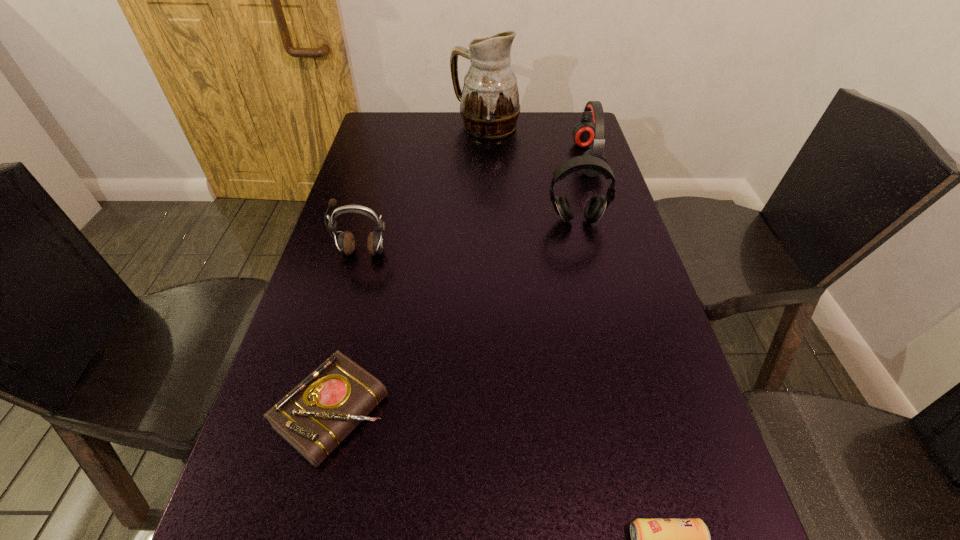
The image size is (960, 540). In order to click on blank space located 0.210m from the spout of the fourth object from right to left in this screenshot , I will do `click(392, 126)`.

Where is `free space located 0.220m on the ear cups of the second farthest earphone`? This screenshot has width=960, height=540. free space located 0.220m on the ear cups of the second farthest earphone is located at coordinates click(x=593, y=291).

I want to click on free spot located 0.190m on the ear cups of the farthest earphone, so click(x=516, y=159).

Where is `vacant space situated 0.380m on the ear cups of the farthest earphone`? This screenshot has height=540, width=960. vacant space situated 0.380m on the ear cups of the farthest earphone is located at coordinates (456, 159).

In order to click on vacant region located on the ear cups of the farthest earphone in this screenshot , I will do `click(500, 159)`.

Locate an element on the screen. The width and height of the screenshot is (960, 540). free region located 0.320m on the ear pads of the nearest earphone is located at coordinates (328, 375).

What are the coordinates of `vacant position located on the back of the second nearest object` in the screenshot? It's located at (373, 248).

Locate an element on the screen. The height and width of the screenshot is (540, 960). pitcher that is at the far edge is located at coordinates (489, 102).

In order to click on earphone that is at the far edge in this screenshot , I will do `click(584, 133)`.

The width and height of the screenshot is (960, 540). Identify the location of earphone located at the left edge. (345, 243).